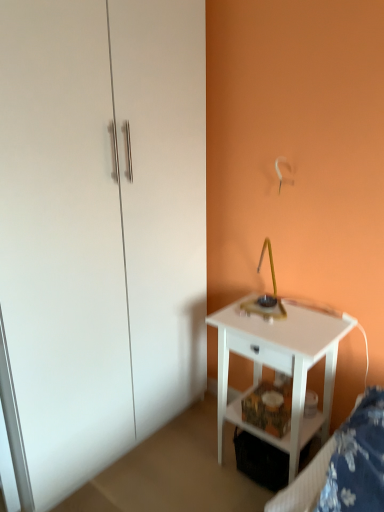
Where is `vacant space situated above white glossy nightstand at lower right (from a real-world perspective)`? Image resolution: width=384 pixels, height=512 pixels. vacant space situated above white glossy nightstand at lower right (from a real-world perspective) is located at coordinates (287, 320).